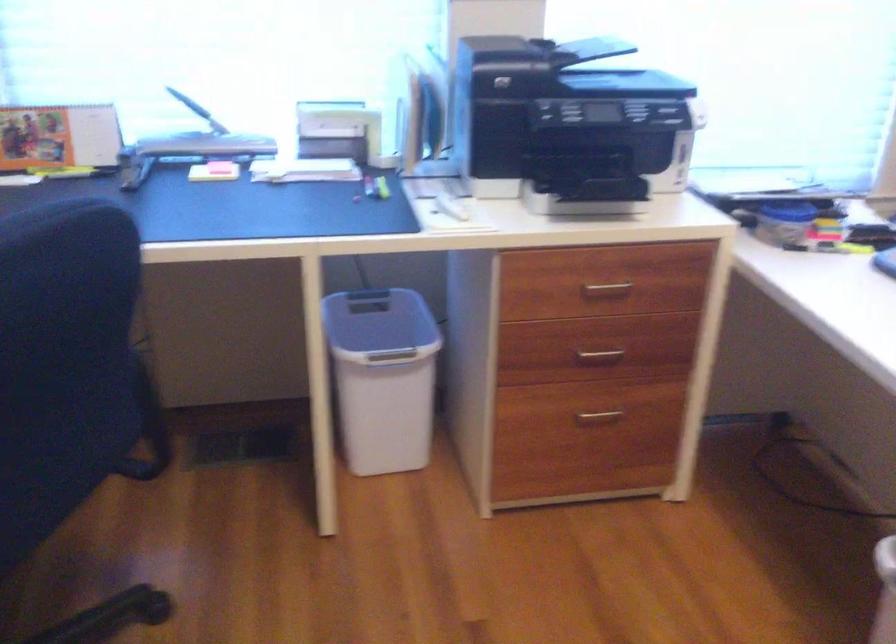
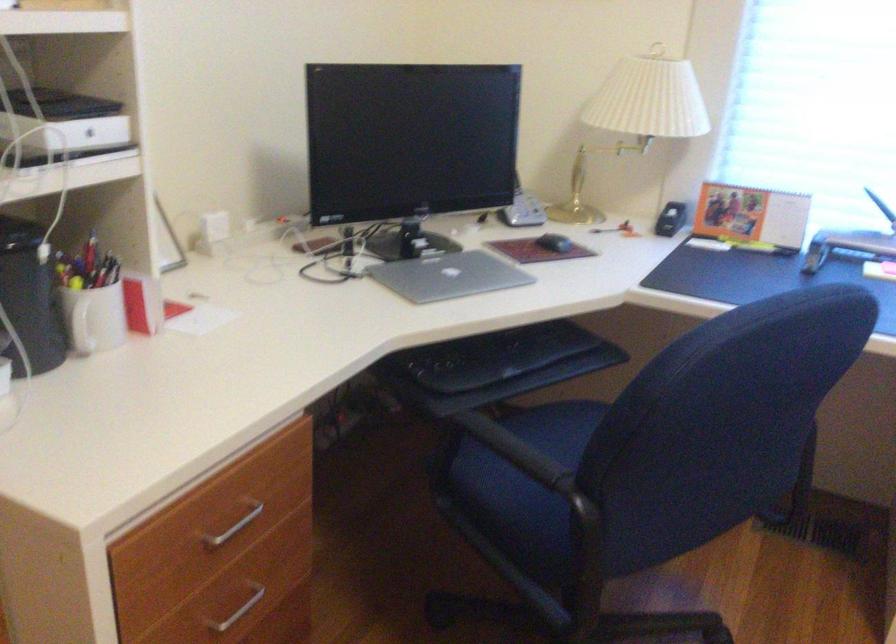
Find the pixel in the second image that matches [170,156] in the first image.

(847, 245)